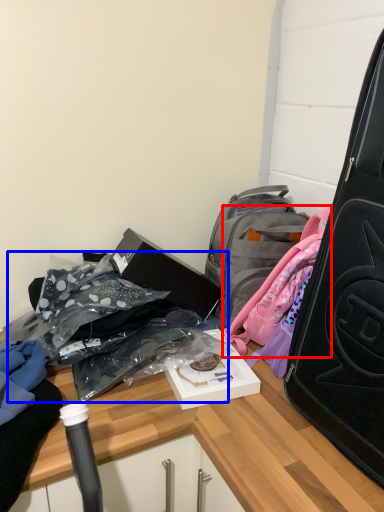
Question: Which object is further to the camera taking this photo, backpack (highlighted by a red box) or bag (highlighted by a blue box)?

Choices:
 (A) backpack
 (B) bag

Answer: (A)